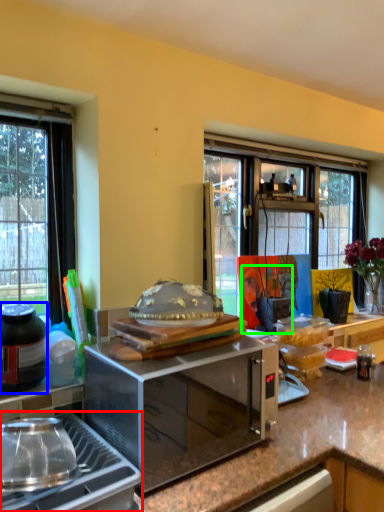
Question: Considering the real-world distances, which object is farthest from gas stove (highlighted by a red box)? bottle (highlighted by a blue box) or person (highlighted by a green box)?

Choices:
 (A) bottle
 (B) person

Answer: (B)